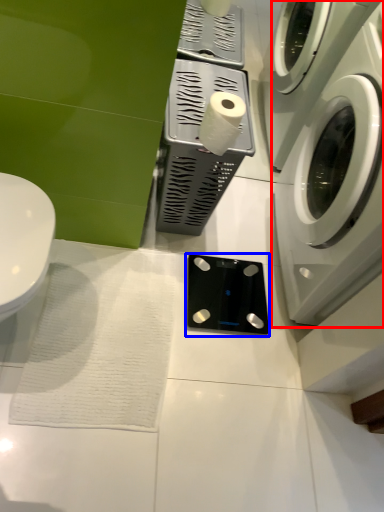
Question: Which object is closer to the camera taking this photo, washing machine (highlighted by a red box) or appliance (highlighted by a blue box)?

Choices:
 (A) washing machine
 (B) appliance

Answer: (A)